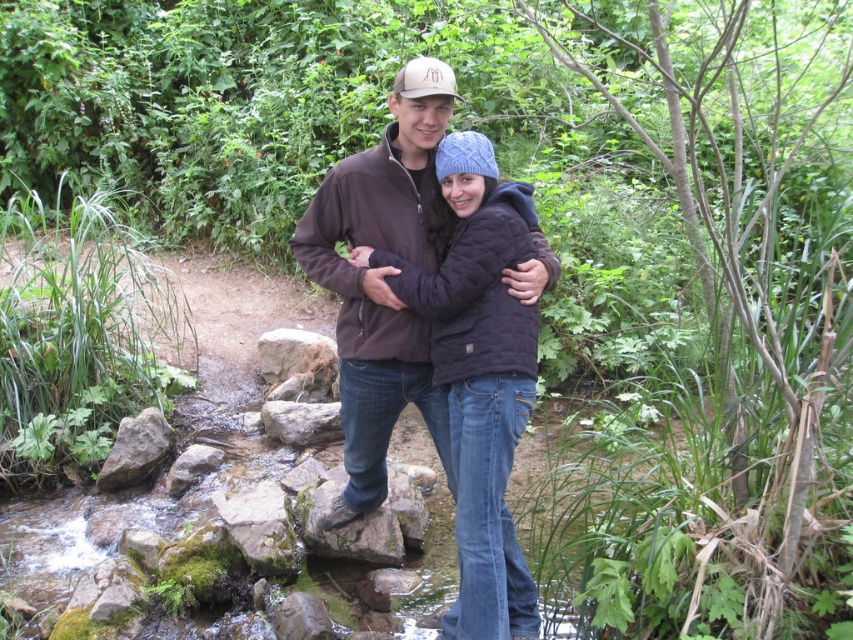
Question: Which of the following is the farthest from the observer?

Choices:
 (A) (281, 429)
 (B) (437, 68)

Answer: (A)

Question: Which object is closer to the camera taking this photo?

Choices:
 (A) gray rough rock at lower left
 (B) dark brown quilted jacket at center

Answer: (B)

Question: Is gray rough rock at center positioned at the back of mossy rock at center?

Choices:
 (A) yes
 (B) no

Answer: (A)

Question: Among these points, which one is farthest from the camera?

Choices:
 (A) (514, 627)
 (B) (413, 68)

Answer: (A)

Question: Can you confirm if dark brown quilted jacket at center is positioned above matte brown baseball cap at upper center?

Choices:
 (A) yes
 (B) no

Answer: (B)

Question: Does gray rough rock at lower left lie behind mossy rock at center?

Choices:
 (A) yes
 (B) no

Answer: (A)